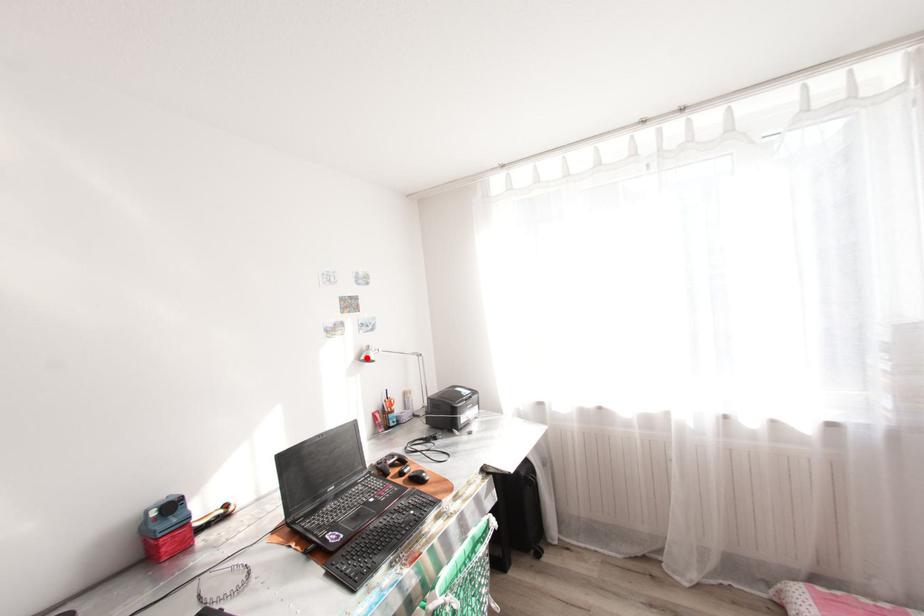
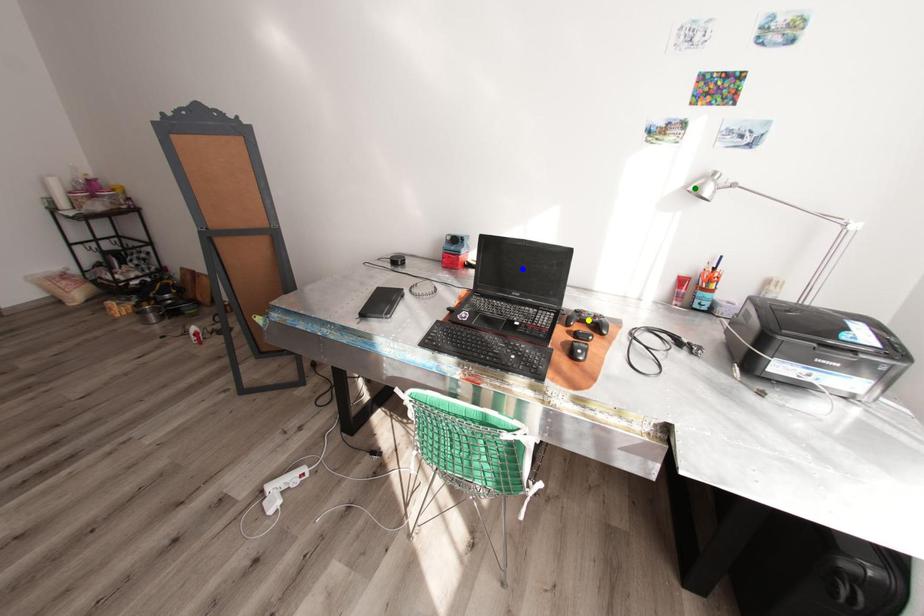
Question: I am providing you with two images of the same scene from different viewpoints. A red point is marked on the first image. You are given multiple points on the second image. Which spot in image 2 lines up with the point in image 1?

Choices:
 (A) green point
 (B) blue point
 (C) yellow point

Answer: (A)